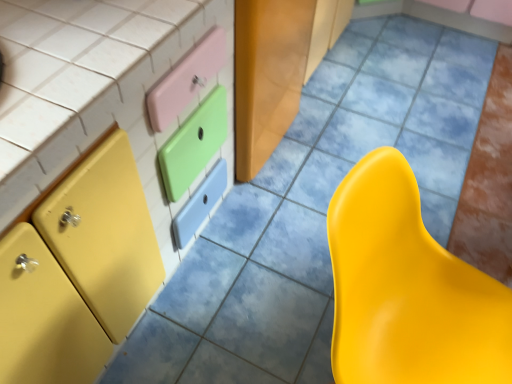
What do you see at coordinates (407, 289) in the screenshot?
I see `glossy plastic chair at center` at bounding box center [407, 289].

The height and width of the screenshot is (384, 512). In order to click on glossy plastic chair at center in this screenshot , I will do `click(407, 289)`.

At what (x,y) coordinates should I click in order to perform the action: click on glossy plastic chair at center. Please return your answer as a coordinate pair (x, y). The width and height of the screenshot is (512, 384). Looking at the image, I should click on tap(407, 289).